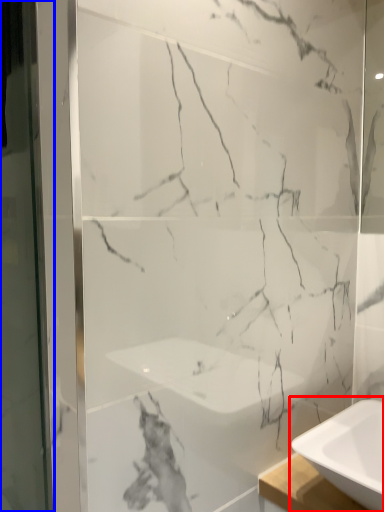
Question: Among these objects, which one is farthest to the camera, sink (highlighted by a red box) or screen door (highlighted by a blue box)?

Choices:
 (A) sink
 (B) screen door

Answer: (A)